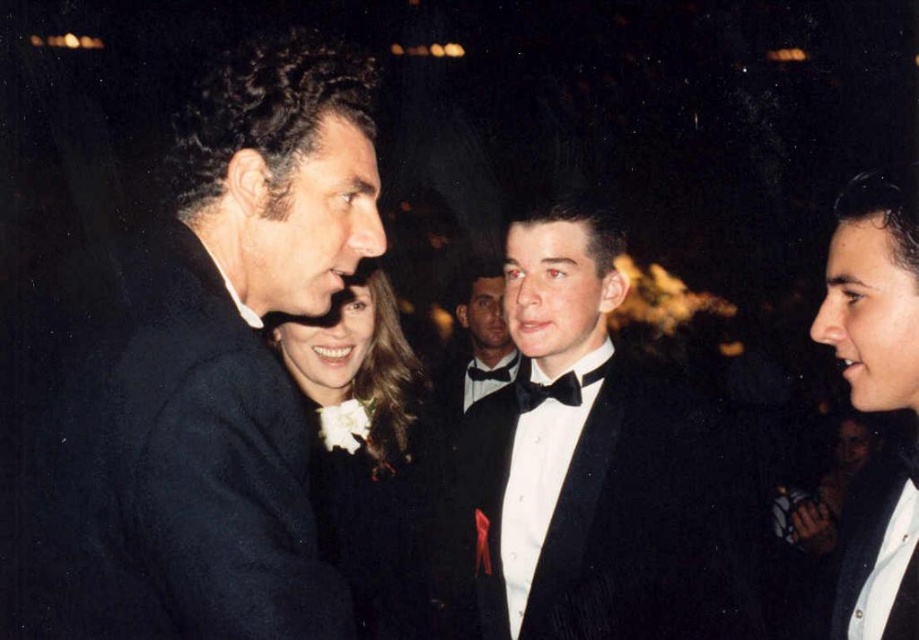
Is velvet black suit at left above white satin flower at center?

Correct, velvet black suit at left is located above white satin flower at center.

Between velvet black suit at left and white satin flower at center, which one is positioned lower?

white satin flower at center is below.

Identify the location of velvet black suit at left. (191, 372).

Where is `velvet black suit at left`? The width and height of the screenshot is (919, 640). velvet black suit at left is located at coordinates (191, 372).

Between velvet black suit at left and shiny black tuxedo at center, which one is positioned lower?

velvet black suit at left is below.

Can you confirm if velvet black suit at left is positioned below shiny black tuxedo at center?

Indeed, velvet black suit at left is positioned under shiny black tuxedo at center.

The image size is (919, 640). In order to click on velvet black suit at left in this screenshot , I will do `click(191, 372)`.

Can you confirm if black velvet tuxedo at center is bigger than white satin flower at center?

Actually, black velvet tuxedo at center might be smaller than white satin flower at center.

Who is higher up, black velvet tuxedo at center or white satin flower at center?

Positioned higher is white satin flower at center.

Between point (615, 566) and point (311, 401), which one is positioned in front?

Point (615, 566) is more forward.

The width and height of the screenshot is (919, 640). I want to click on black velvet tuxedo at center, so click(x=596, y=513).